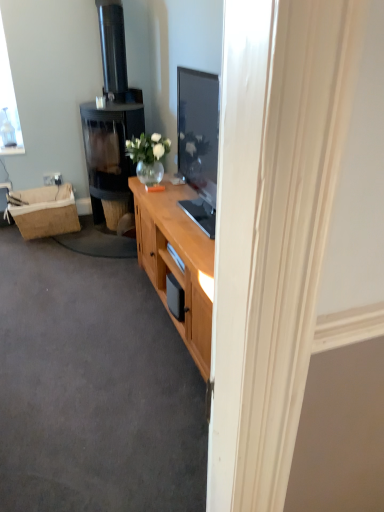
Question: From a real-world perspective, is burlap picnic basket at left over black glass fireplace at left?

Choices:
 (A) no
 (B) yes

Answer: (A)

Question: From the image's perspective, would you say burlap picnic basket at left is shown under black glass fireplace at left?

Choices:
 (A) yes
 (B) no

Answer: (A)

Question: Is burlap picnic basket at left touching black glass fireplace at left?

Choices:
 (A) no
 (B) yes

Answer: (A)

Question: Considering the relative sizes of burlap picnic basket at left and black glass fireplace at left in the image provided, is burlap picnic basket at left wider than black glass fireplace at left?

Choices:
 (A) no
 (B) yes

Answer: (A)

Question: Is burlap picnic basket at left aimed at black glass fireplace at left?

Choices:
 (A) no
 (B) yes

Answer: (A)

Question: Is burlap picnic basket at left further to camera compared to black glass fireplace at left?

Choices:
 (A) no
 (B) yes

Answer: (B)

Question: Is black glass fireplace at left thinner than burlap picnic basket at left?

Choices:
 (A) no
 (B) yes

Answer: (A)

Question: Can you confirm if black glass fireplace at left is positioned to the left of burlap picnic basket at left?

Choices:
 (A) yes
 (B) no

Answer: (B)

Question: Is black glass fireplace at left in contact with burlap picnic basket at left?

Choices:
 (A) no
 (B) yes

Answer: (A)

Question: Is black glass fireplace at left not inside burlap picnic basket at left?

Choices:
 (A) no
 (B) yes

Answer: (B)

Question: Is burlap picnic basket at left located within black glass fireplace at left?

Choices:
 (A) yes
 (B) no

Answer: (B)

Question: From a real-world perspective, is black glass fireplace at left beneath burlap picnic basket at left?

Choices:
 (A) no
 (B) yes

Answer: (A)

Question: Does black glass fireplace at left have a larger size compared to wooden cabinet at center?

Choices:
 (A) yes
 (B) no

Answer: (A)